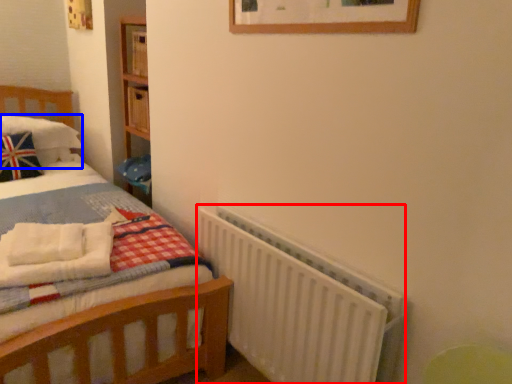
Question: Which object appears closest to the camera in this image, radiator (highlighted by a red box) or pillow (highlighted by a blue box)?

Choices:
 (A) radiator
 (B) pillow

Answer: (A)